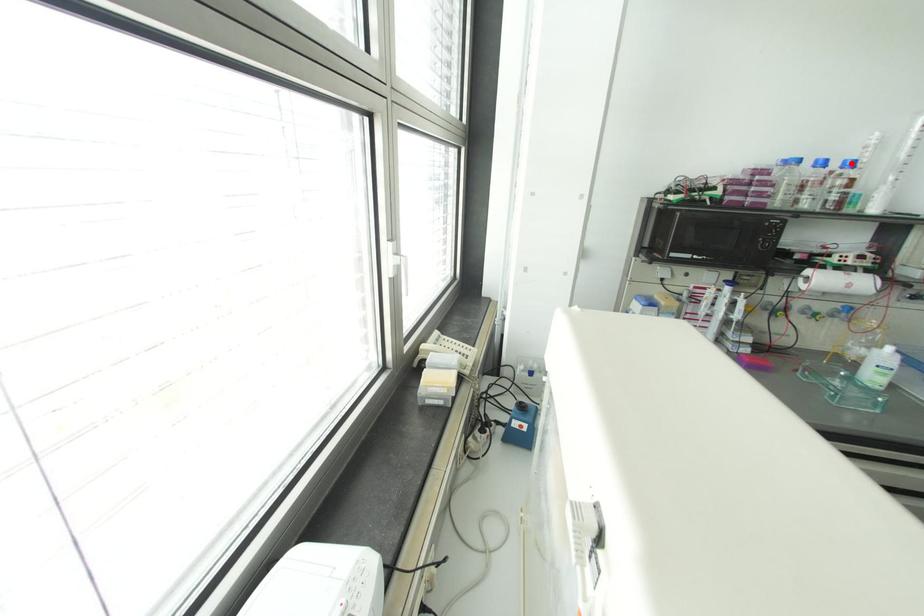
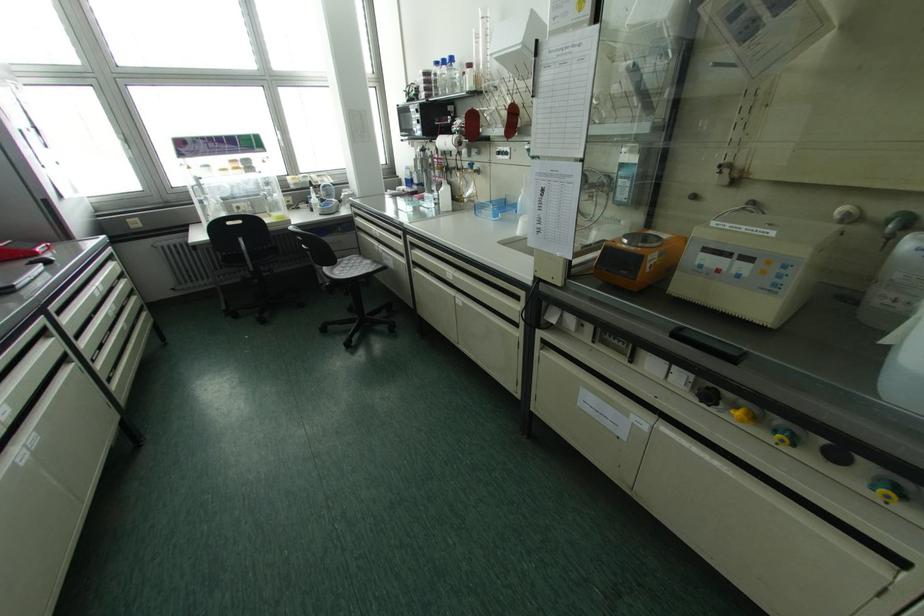
Where in the second image is the point corresponding to the highlighted location from the first image?

(451, 59)